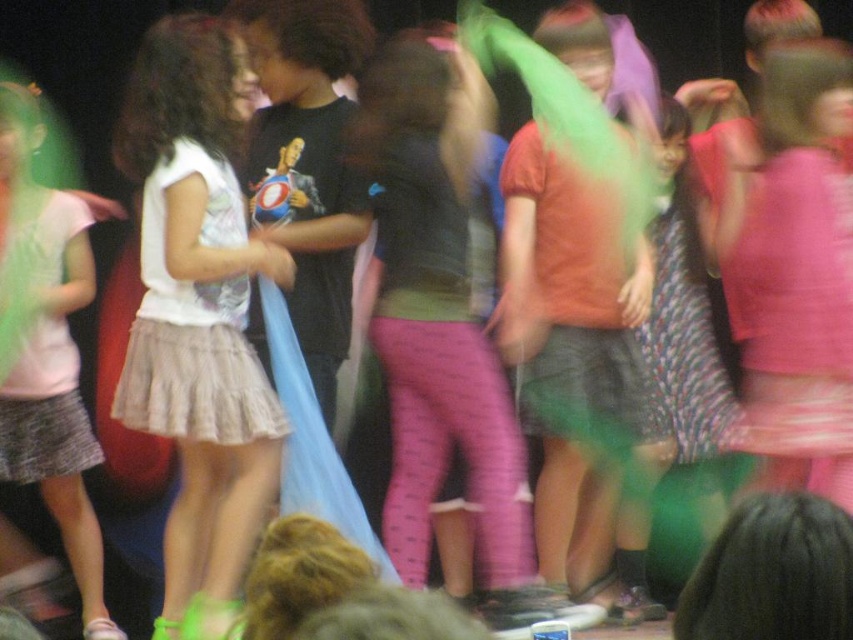
Between point (207, 557) and point (22, 483), which one is positioned behind?

The point (22, 483) is more distant.

Does white matte skirt at left come in front of matte white skirt at left?

That is True.

Does point (216, 362) come behind point (70, 492)?

No, it is not.

You are a GUI agent. You are given a task and a screenshot of the screen. Output one action in this format:
    pyautogui.click(x=<x>, y=<y>)
    Task: Click on the white matte skirt at left
    The image size is (853, 640).
    Given the screenshot: What is the action you would take?
    pyautogui.click(x=198, y=314)